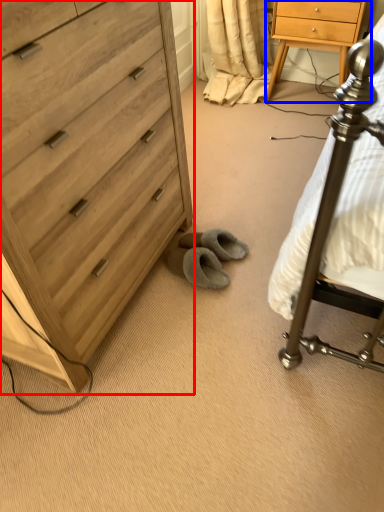
Question: Which of the following is the closest to the observer, chest of drawers (highlighted by a red box) or nightstand (highlighted by a blue box)?

Choices:
 (A) chest of drawers
 (B) nightstand

Answer: (A)